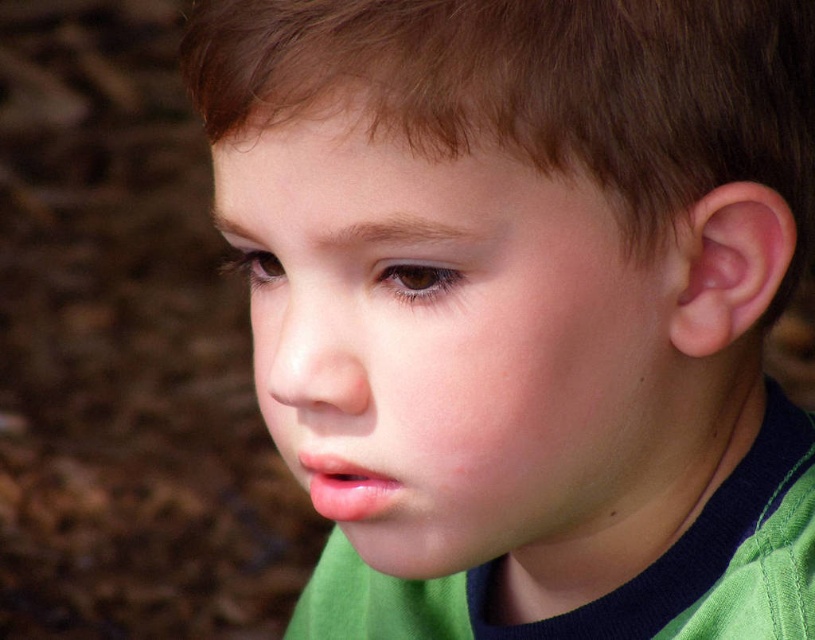
The width and height of the screenshot is (815, 640). I want to click on smooth skin face at center, so click(456, 346).

Is point (491, 220) positioned in front of point (657, 36)?

Yes, point (491, 220) is in front of point (657, 36).

Is point (324, 428) positioned behind point (688, 164)?

Yes, it is.

Where is `smooth skin face at center`? This screenshot has width=815, height=640. smooth skin face at center is located at coordinates (456, 346).